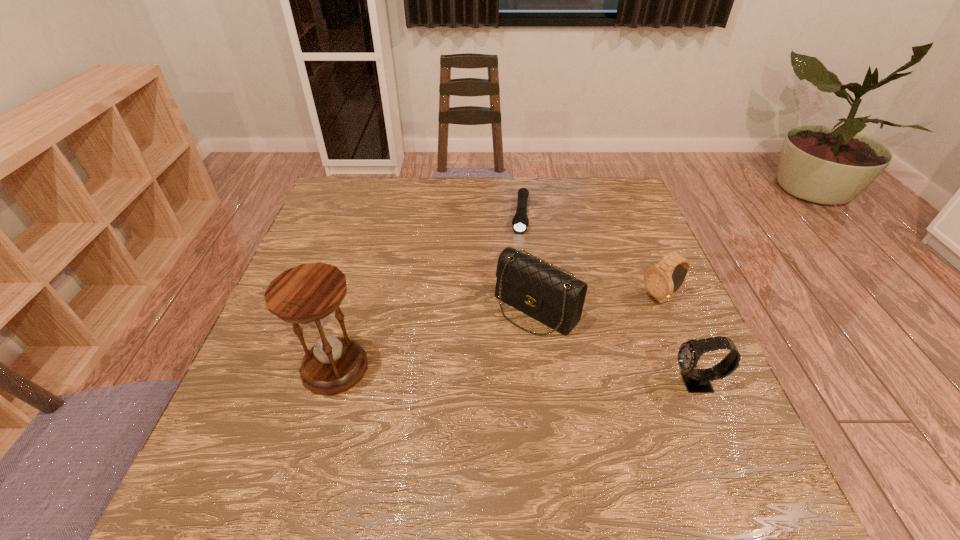
Image resolution: width=960 pixels, height=540 pixels. Identify the location of object at the far edge. (520, 222).

Where is `object that is at the left edge`? This screenshot has height=540, width=960. object that is at the left edge is located at coordinates (307, 294).

Locate an element on the screen. free space at the far edge of the desktop is located at coordinates (517, 190).

In the image, there is a desktop. In order to click on vacant space at the near edge in this screenshot , I will do `click(508, 436)`.

In the image, there is a desktop. At what (x,y) coordinates should I click in order to perform the action: click on free space at the left edge. Please return your answer as a coordinate pair (x, y). Looking at the image, I should click on point(277,390).

In the image, there is a desktop. Find the location of `vacant space at the right edge`. vacant space at the right edge is located at coordinates (x=681, y=344).

Where is `vacant area at the far left corner of the desktop`? This screenshot has height=540, width=960. vacant area at the far left corner of the desktop is located at coordinates (353, 180).

The image size is (960, 540). I want to click on vacant space at the far right corner of the desktop, so click(x=588, y=202).

The height and width of the screenshot is (540, 960). I want to click on free space at the near right corner of the desktop, so click(x=681, y=422).

At what (x,y) coordinates should I click in order to perform the action: click on free space between the leftmost object and the farther watch. Please return your answer as a coordinate pair (x, y). This screenshot has width=960, height=540. Looking at the image, I should click on (498, 333).